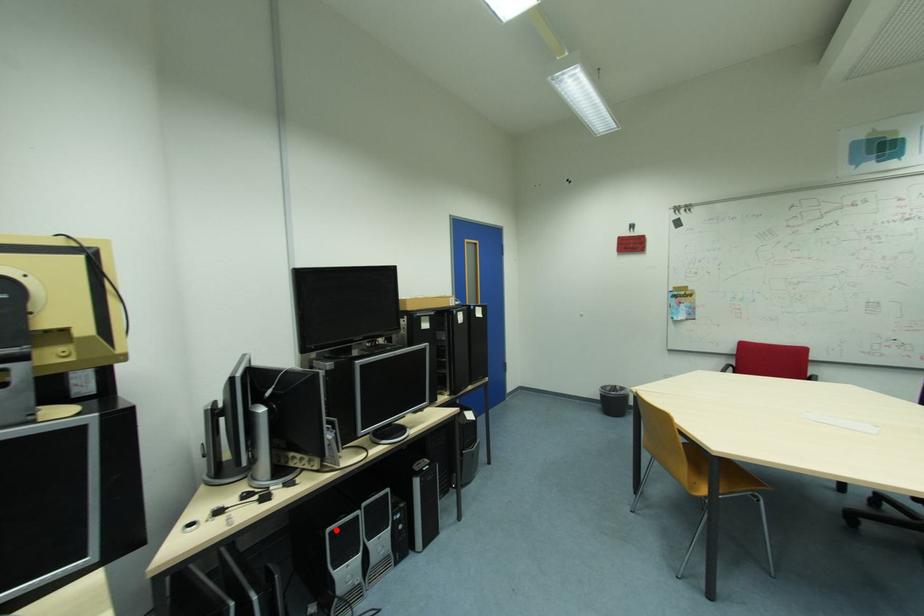
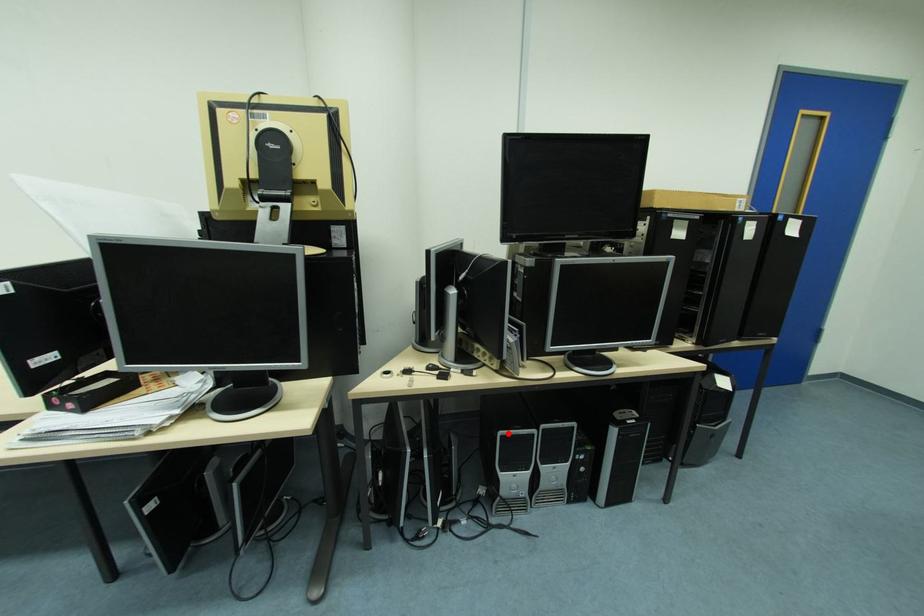
I am providing you with two images of the same scene from different viewpoints. A red point is marked on the first image and another point is marked on the second image. Do the highlighted points in image1 and image2 indicate the same real-world spot?

Yes